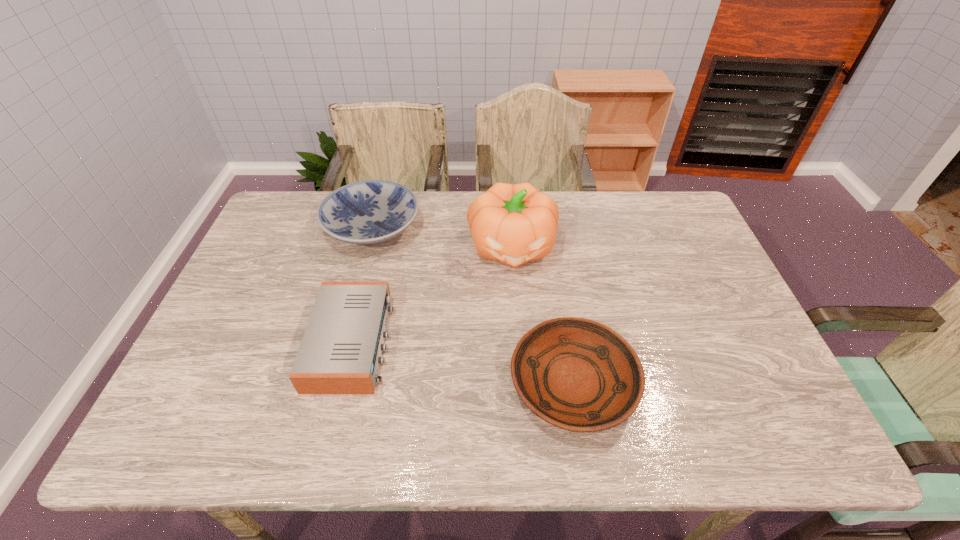
Locate an element on the screen. This screenshot has width=960, height=540. vacant region that satisfies the following two spatial constraints: 1. on the carved face of the right plate; 2. on the left side of the tallest object is located at coordinates (522, 383).

This screenshot has width=960, height=540. In order to click on free spot that satisfies the following two spatial constraints: 1. on the carved face of the pumpkin; 2. on the front panel of the radio receiver in this screenshot , I will do `click(519, 342)`.

The width and height of the screenshot is (960, 540). I want to click on free space that satisfies the following two spatial constraints: 1. on the carved face of the nearer plate; 2. on the left side of the pumpkin, so click(522, 383).

What are the coordinates of `blank area in the image that satisfies the following two spatial constraints: 1. on the carved face of the tallest object; 2. on the front panel of the radio receiver` in the screenshot? It's located at (519, 342).

The height and width of the screenshot is (540, 960). In order to click on blank space that satisfies the following two spatial constraints: 1. on the carved face of the tallest object; 2. on the front panel of the radio receiver in this screenshot , I will do `click(519, 342)`.

Find the location of a particular element. free space in the image that satisfies the following two spatial constraints: 1. on the front side of the nearer plate; 2. on the left side of the left plate is located at coordinates (331, 383).

You are a GUI agent. You are given a task and a screenshot of the screen. Output one action in this format:
    pyautogui.click(x=<x>, y=<y>)
    Task: Click on the free location that satisfies the following two spatial constraints: 1. on the front panel of the nearer plate; 2. on the right side of the radio receiver
    This screenshot has width=960, height=540.
    Given the screenshot: What is the action you would take?
    pyautogui.click(x=342, y=383)

Where is `free space that satisfies the following two spatial constraints: 1. on the carved face of the tallest object; 2. on the front panel of the radio receiver`? Image resolution: width=960 pixels, height=540 pixels. free space that satisfies the following two spatial constraints: 1. on the carved face of the tallest object; 2. on the front panel of the radio receiver is located at coordinates (519, 342).